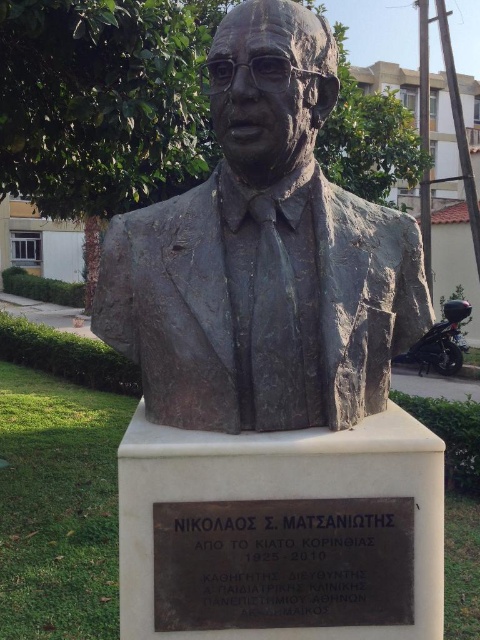
What is located at the coordinates point (264,256)?

The bronze statue at center is located at point (264,256).

You are an art conservator assessing the placement of the bronze statue at center and the black metal plaque at center. Based on their widths, which object should be considered for potential structural reinforcement to prevent tipping? Please explain your reasoning using the provided information.

The bronze statue at center might be wider than black metal plaque at center, so the bronze statue at center should be considered for potential structural reinforcement to prevent tipping since a wider base generally provides more stability. However, the exact dimensions are uncertain as the description only states it might be wider.